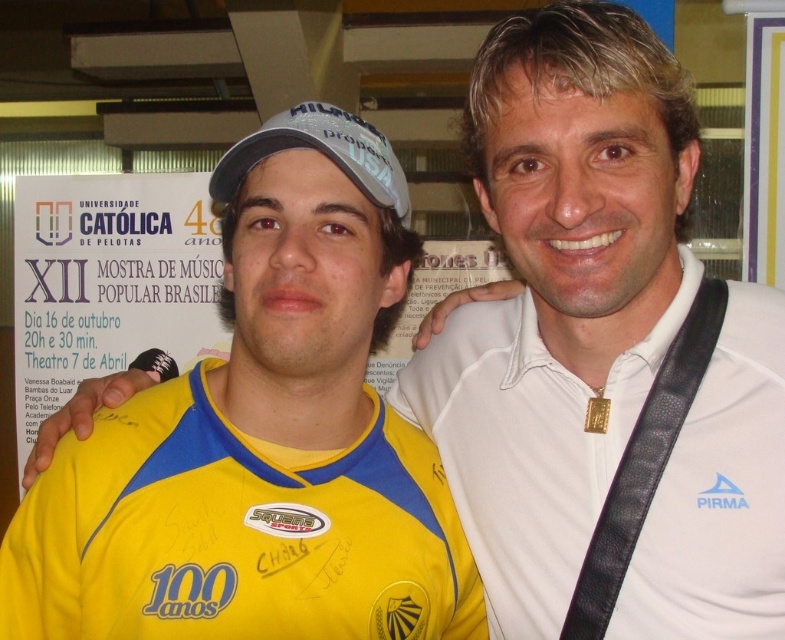
Question: Which point is closer to the camera?

Choices:
 (A) (517, 332)
 (B) (333, 112)

Answer: (B)

Question: Is white matte polo shirt at center wider than white matte baseball cap at center?

Choices:
 (A) no
 (B) yes

Answer: (B)

Question: Among these objects, which one is nearest to the camera?

Choices:
 (A) white matte baseball cap at center
 (B) white matte polo shirt at center

Answer: (B)

Question: Where is white matte polo shirt at center located in relation to white matte baseball cap at center in the image?

Choices:
 (A) right
 (B) left

Answer: (A)

Question: Is white matte polo shirt at center thinner than white matte baseball cap at center?

Choices:
 (A) yes
 (B) no

Answer: (B)

Question: Which point appears farthest from the camera in this image?

Choices:
 (A) (367, 172)
 (B) (498, 464)

Answer: (B)